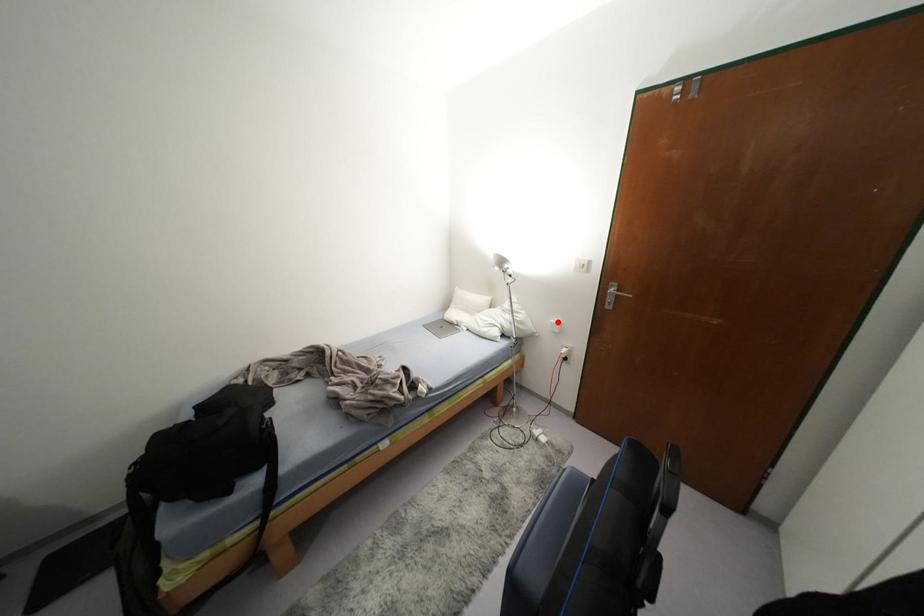
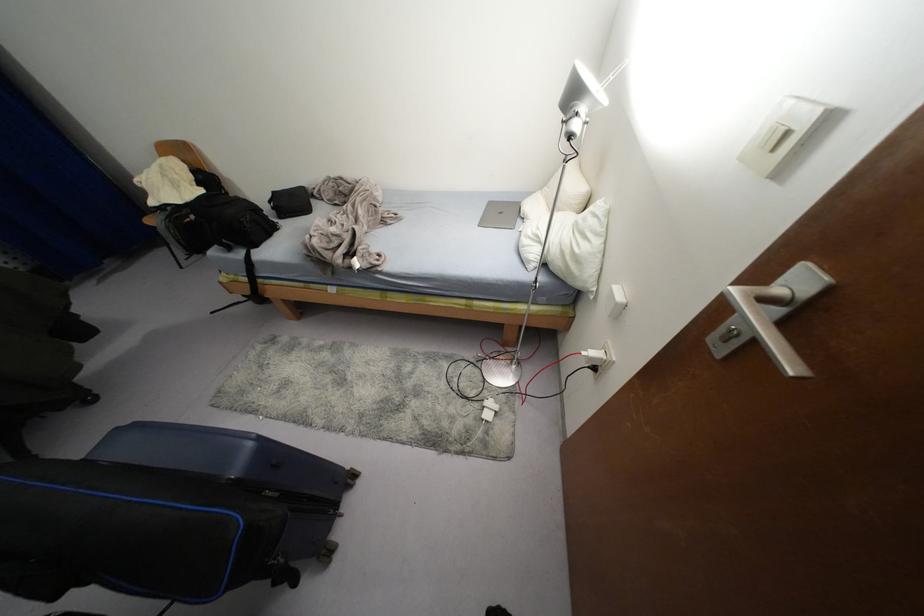
Question: I am providing you with two images of the same scene from different viewpoints. A red point is shown in image1. For the corresponding object point in image2, is it positioned nearer or farther from the camera?

Choices:
 (A) Nearer
 (B) Farther

Answer: (A)